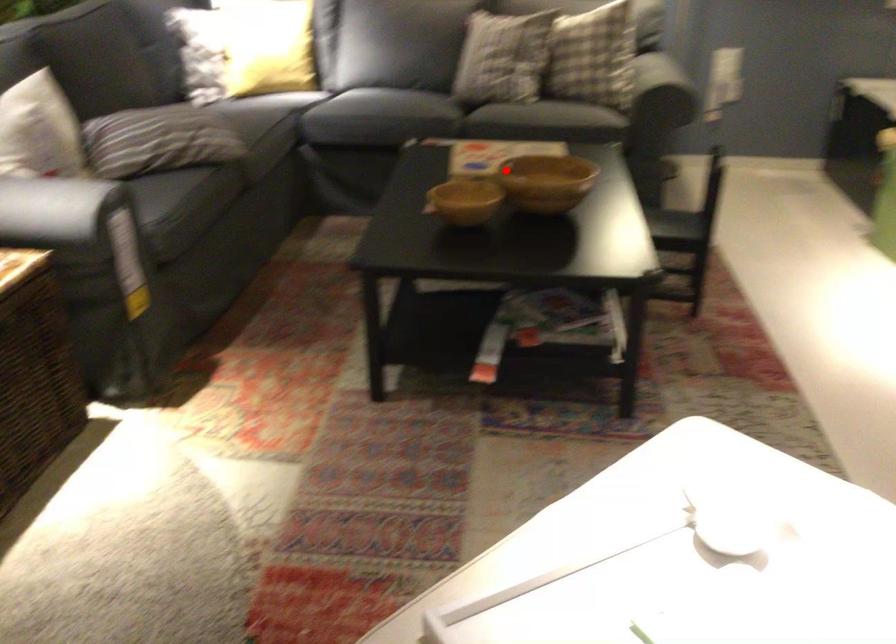
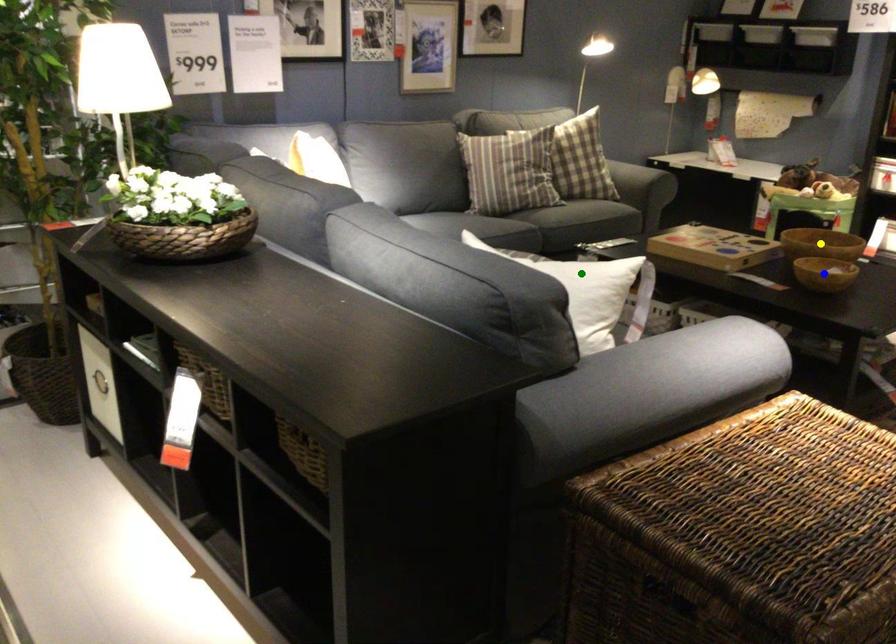
Question: I am providing you with two images of the same scene from different viewpoints. A red point is marked on the first image. You are given multiple points on the second image. Which spot in image 2 lines up with the point in image 1?

Choices:
 (A) green point
 (B) blue point
 (C) yellow point

Answer: (C)